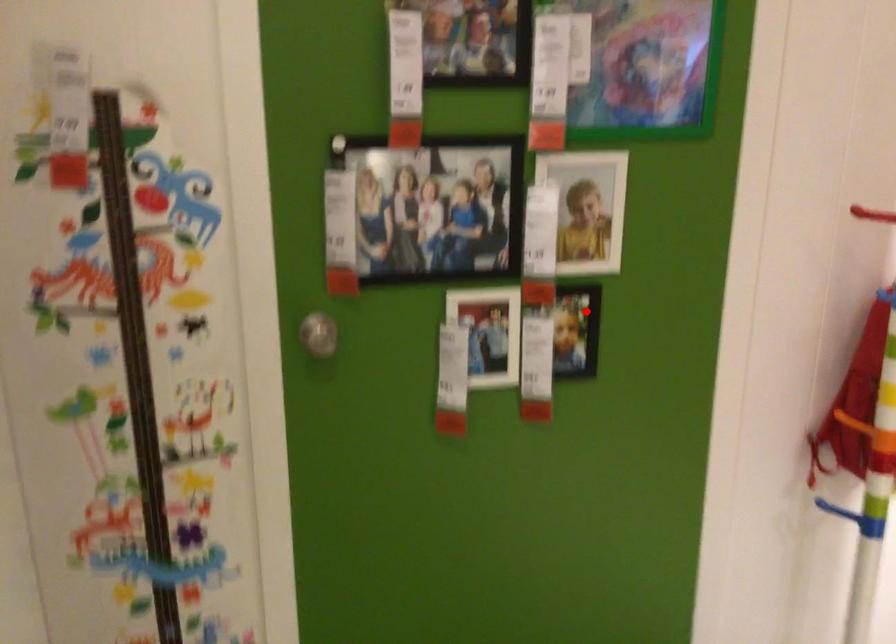
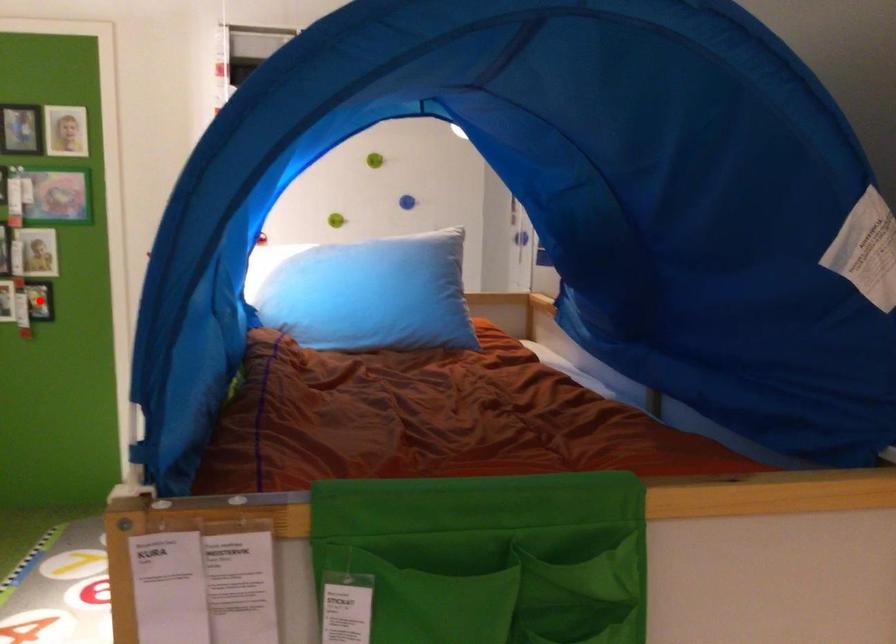
I am providing you with two images of the same scene from different viewpoints. A red point is marked on the first image and another point is marked on the second image. Is the marked point in image1 the same physical position as the marked point in image2?

Yes